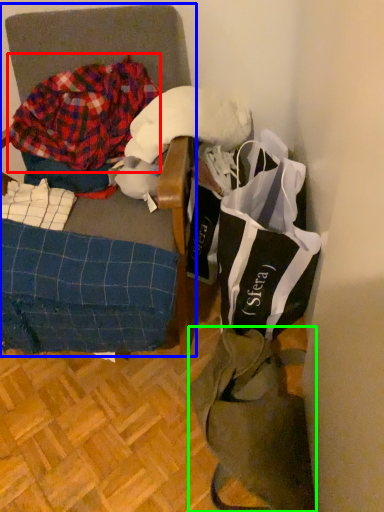
Question: Which object is the farthest from flannel (highlighted by a red box)? Choose among these: furniture (highlighted by a blue box) or tote bag (highlighted by a green box).

Choices:
 (A) furniture
 (B) tote bag

Answer: (B)